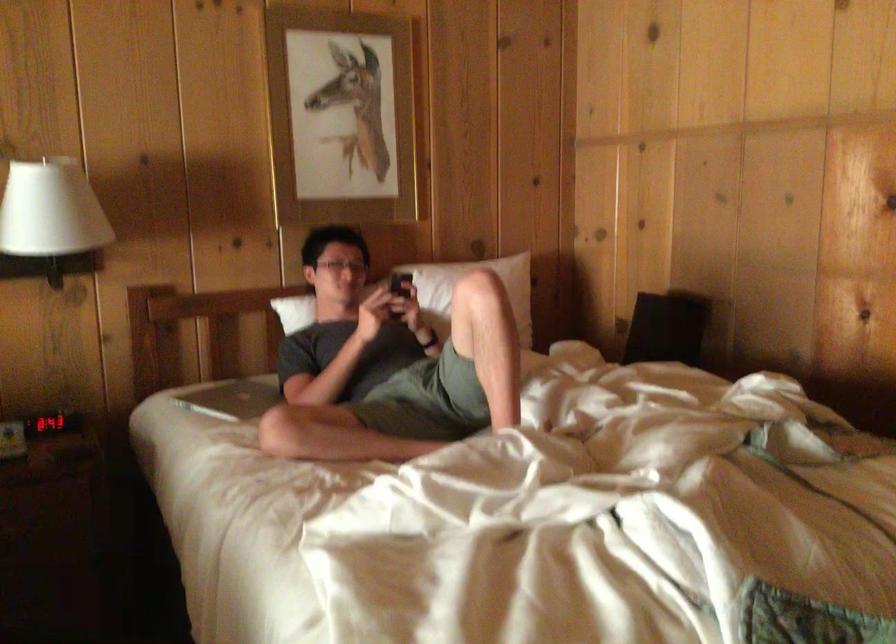
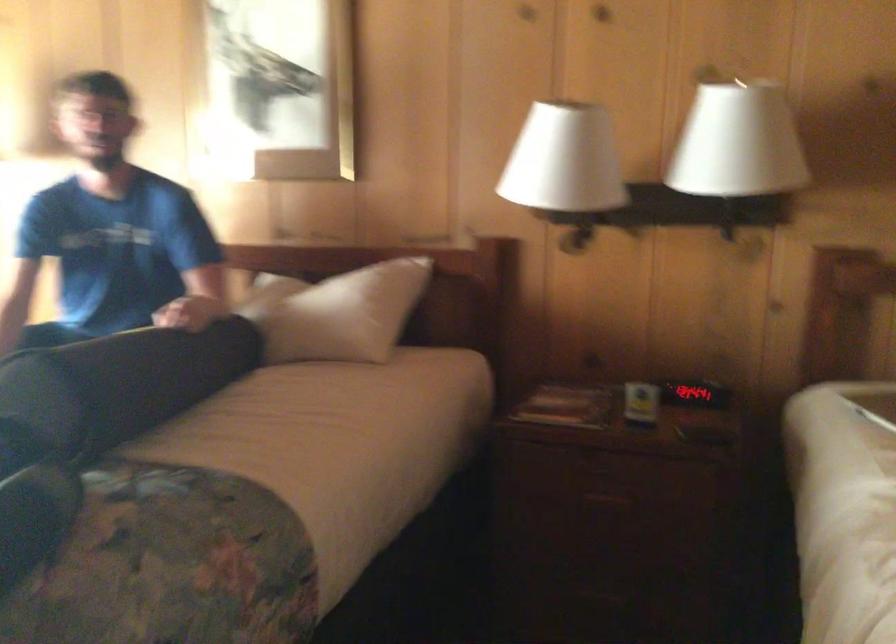
Question: The first image is from the beginning of the video and the second image is from the end. How did the camera likely rotate when shooting the video?

Choices:
 (A) Left
 (B) Right
 (C) Up
 (D) Down

Answer: (A)